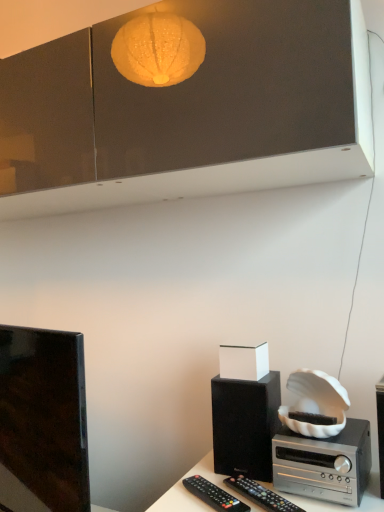
Question: Is silver metallic stereo at lower right taller or shorter than black matte speaker at lower right?

Choices:
 (A) tall
 (B) short

Answer: (B)

Question: From a real-world perspective, relative to black matte speaker at lower right, is silver metallic stereo at lower right vertically above or below?

Choices:
 (A) above
 (B) below

Answer: (B)

Question: Estimate the real-world distances between objects in this image. Which object is farther from the black matte speaker at right?

Choices:
 (A) shiny black tv at left
 (B) black plastic remote at lower right, the first remote control in the right-to-left sequence
 (C) silver metallic stereo at lower right
 (D) black plastic remote control at lower center, the 1th remote control in the left-to-right sequence
 (E) black matte speaker at lower right

Answer: (A)

Question: Based on their relative distances, which object is farther from the black matte speaker at right?

Choices:
 (A) shiny black tv at left
 (B) black matte speaker at lower right
 (C) black plastic remote at lower right, the 2th remote control in the left-to-right sequence
 (D) silver metallic stereo at lower right
 (E) black plastic remote control at lower center, the 1th remote control in the left-to-right sequence

Answer: (A)